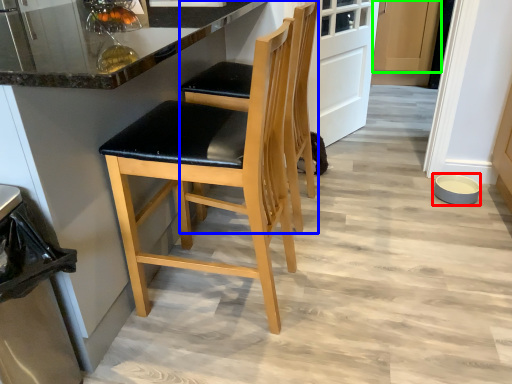
Question: Which is farther away from bowl (highlighted by a red box)? chair (highlighted by a blue box) or cabinetry (highlighted by a green box)?

Choices:
 (A) chair
 (B) cabinetry

Answer: (B)